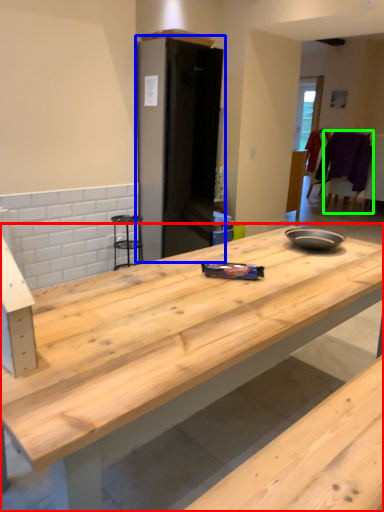
Question: Considering the real-world distances, which object is farthest from countertop (highlighted by a red box)? appliance (highlighted by a blue box) or chair (highlighted by a green box)?

Choices:
 (A) appliance
 (B) chair

Answer: (B)